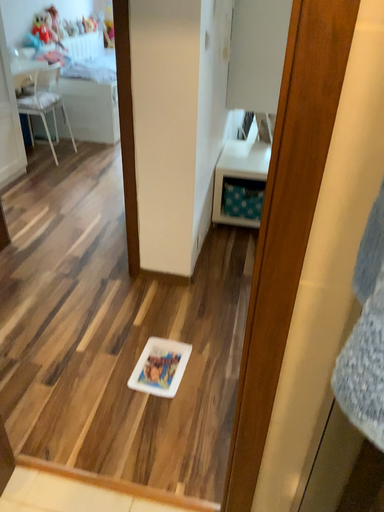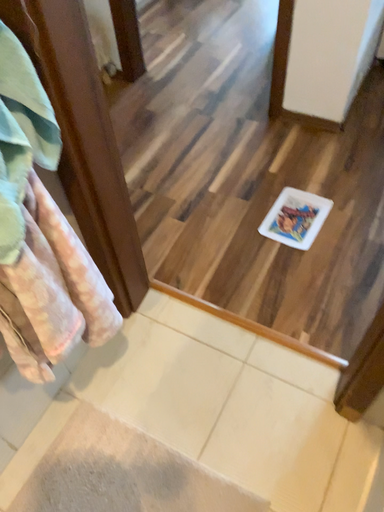
Question: Which way did the camera rotate in the video?

Choices:
 (A) rotated left
 (B) rotated right

Answer: (A)